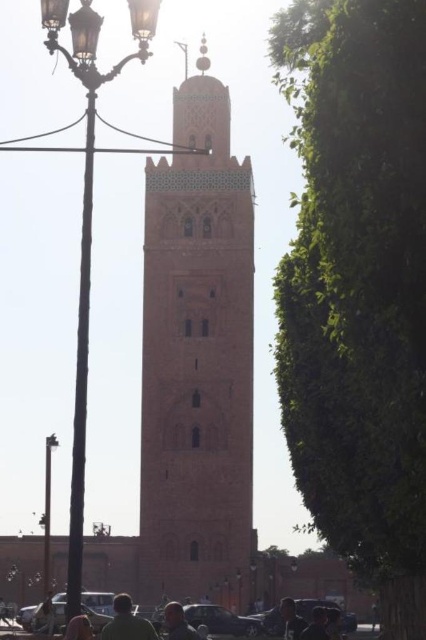
You are standing at the center of the plaza and want to locate the antique brass streetlight at left. According to the coordinates provided, in which direction should you look to find it?

The antique brass streetlight at left is located at coordinates point (x=95, y=35), which would be to the left side of the plaza from your central position.

You are an architect analyzing the spatial arrangement of the scene. You notice the brick textured bell tower at center and the light brown hair at center. Which object is placed higher in the image?

The brick textured bell tower at center is positioned over light brown hair at center, so it is higher in the image.

You are standing in the plaza and see the light brown hair at center and the green fabric person at lower left. Which one is closer to you?

The light brown hair at center is closer to you because it is further to the viewer than the green fabric person at lower left.